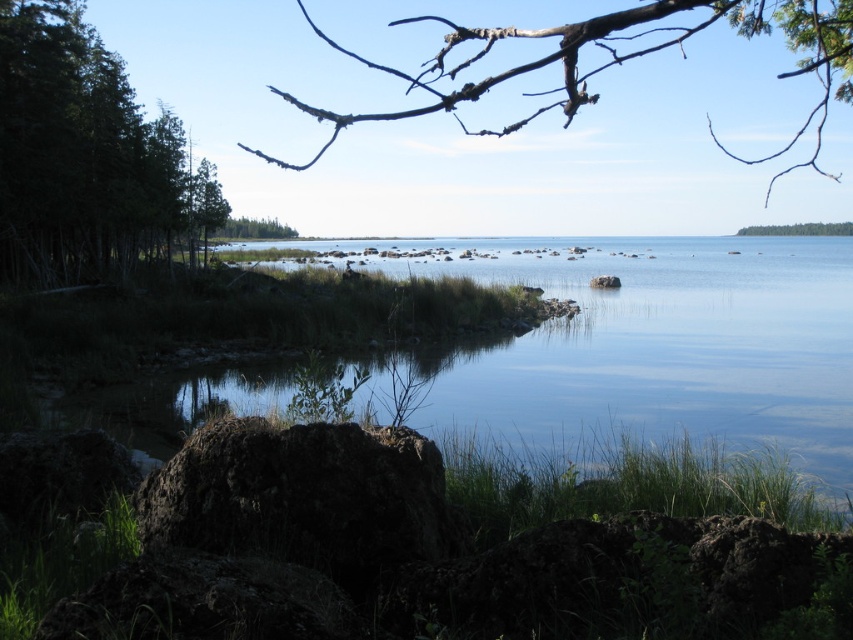
You are standing at the edge of the lake and want to find the clear water at center. According to the coordinates given, where exactly should you look?

You should look at point 0.570 on the x axis and 0.760 on the y axis to find the clear water at center.

You are standing at the lakeside and want to take a photo of the clear water at center without any tree branches blocking the view. Since the green leafy tree at upper right is above the water, will its branches interfere with your photo?

The clear water at center is positioned under the green leafy tree at upper right, so the branches of the tree may block the view of the water in your photo.